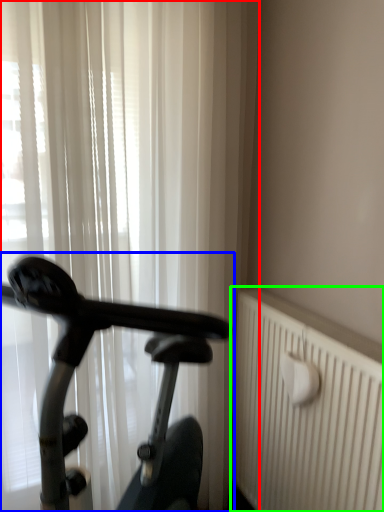
Question: Considering the real-world distances, which object is closest to curtain (highlighted by a red box)? bicycle (highlighted by a blue box) or radiator (highlighted by a green box).

Choices:
 (A) bicycle
 (B) radiator

Answer: (A)